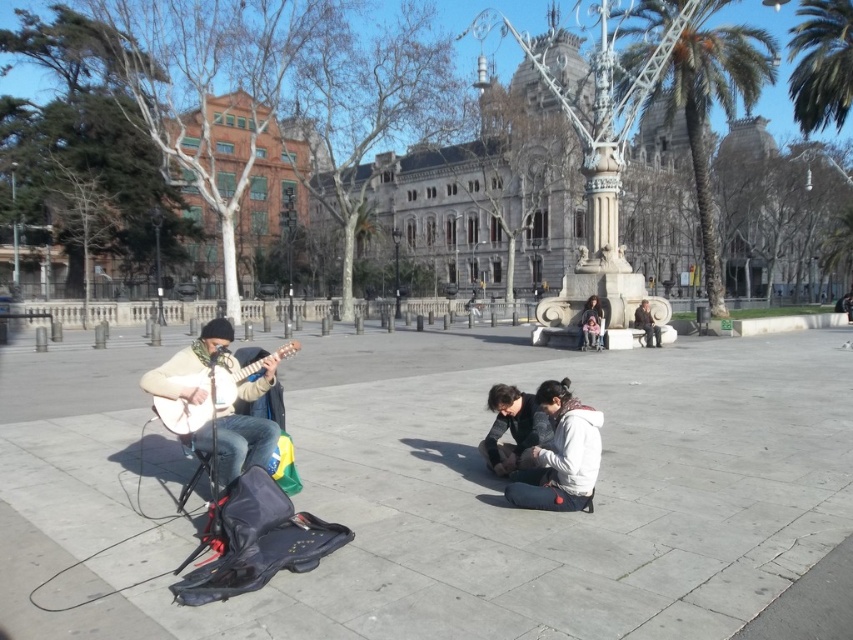
Does matte brown acoustic guitar at left appear over matte black jacket at center?

Actually, matte brown acoustic guitar at left is below matte black jacket at center.

From the picture: Can you confirm if matte brown acoustic guitar at left is thinner than matte black jacket at center?

In fact, matte brown acoustic guitar at left might be wider than matte black jacket at center.

Measure the distance between point [212,374] and camera.

Point [212,374] and camera are 15.22 feet apart from each other.

This screenshot has width=853, height=640. Find the location of `matte brown acoustic guitar at left`. matte brown acoustic guitar at left is located at coordinates (209, 392).

Between white matte jacket at center and dark gray fabric jacket at center, which one is positioned lower?

Positioned lower is white matte jacket at center.

Who is higher up, white matte jacket at center or dark gray fabric jacket at center?

dark gray fabric jacket at center is higher up.

At what (x,y) coordinates should I click in order to perform the action: click on white matte jacket at center. Please return your answer as a coordinate pair (x, y). This screenshot has width=853, height=640. Looking at the image, I should click on (560, 456).

Who is more forward, (712, 88) or (553, 451)?

Point (553, 451) is more forward.

Who is more distant from viewer, (631,10) or (593,474)?

The point (631,10) is behind.

Where is `green leafy palm tree at upper right`? green leafy palm tree at upper right is located at coordinates (711, 104).